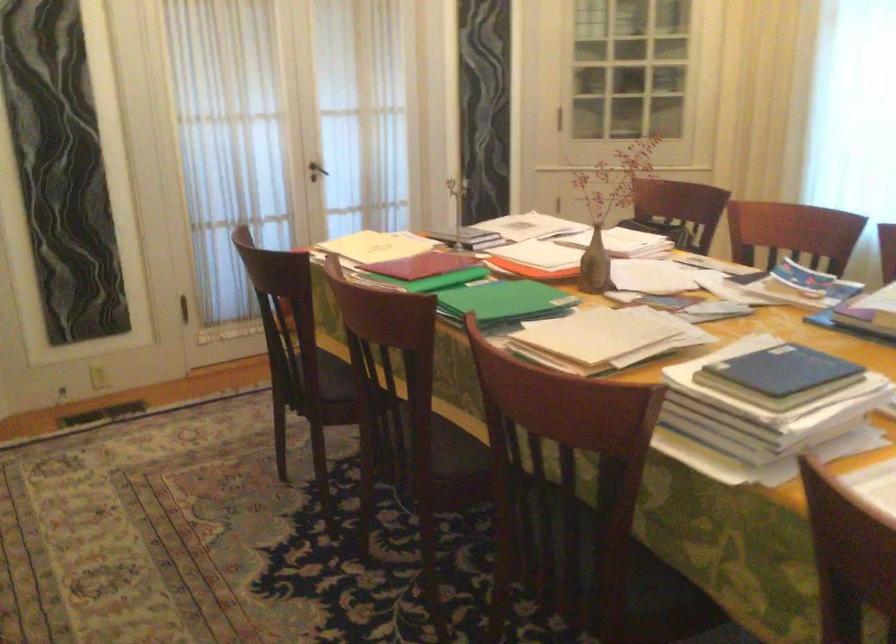
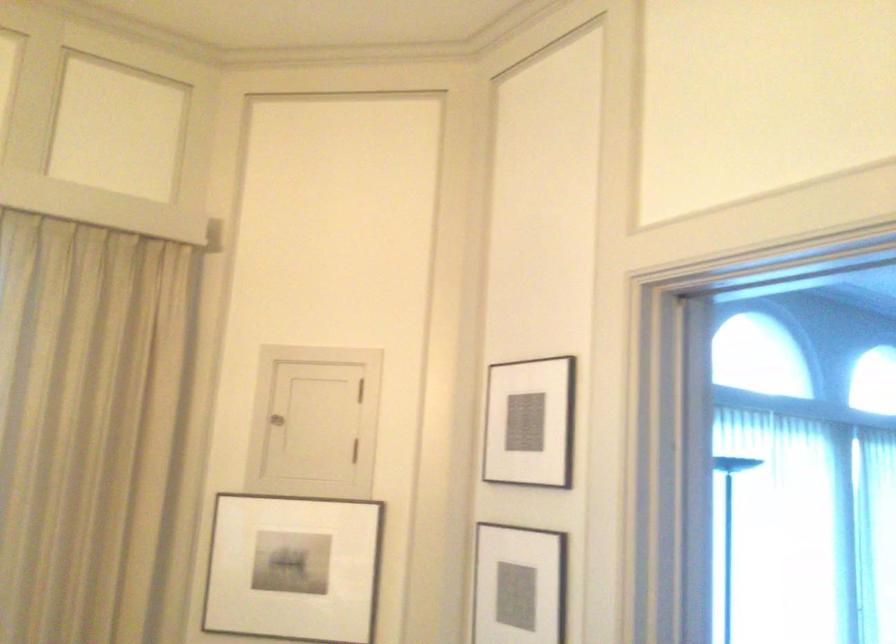
First-person continuous shooting, in which direction is the camera rotating?

The camera rotated toward right-up.